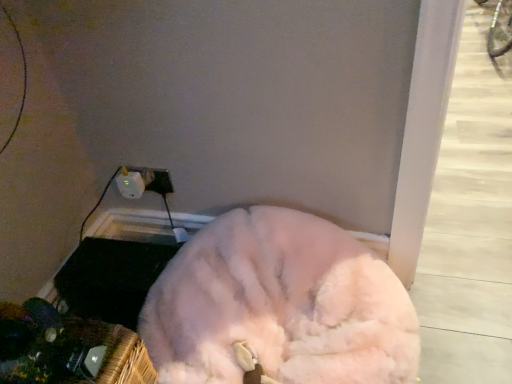
Question: Considering the positions of fluffy white dog at lower center and white plastic electric outlet at lower left in the image, is fluffy white dog at lower center wider or thinner than white plastic electric outlet at lower left?

Choices:
 (A) thin
 (B) wide

Answer: (B)

Question: In the image, is fluffy white dog at lower center positioned in front of or behind white plastic electric outlet at lower left?

Choices:
 (A) front
 (B) behind

Answer: (A)

Question: From the image's perspective, is fluffy white dog at lower center above or below white plastic electric outlet at lower left?

Choices:
 (A) above
 (B) below

Answer: (B)

Question: From a real-world perspective, relative to fluffy white dog at lower center, is white plastic electric outlet at lower left vertically above or below?

Choices:
 (A) below
 (B) above

Answer: (B)

Question: In terms of size, does white plastic electric outlet at lower left appear bigger or smaller than fluffy white dog at lower center?

Choices:
 (A) small
 (B) big

Answer: (A)

Question: From the image's perspective, is white plastic electric outlet at lower left above or below fluffy white dog at lower center?

Choices:
 (A) below
 (B) above

Answer: (B)

Question: Do you think white plastic electric outlet at lower left is within fluffy white dog at lower center, or outside of it?

Choices:
 (A) outside
 (B) inside

Answer: (A)